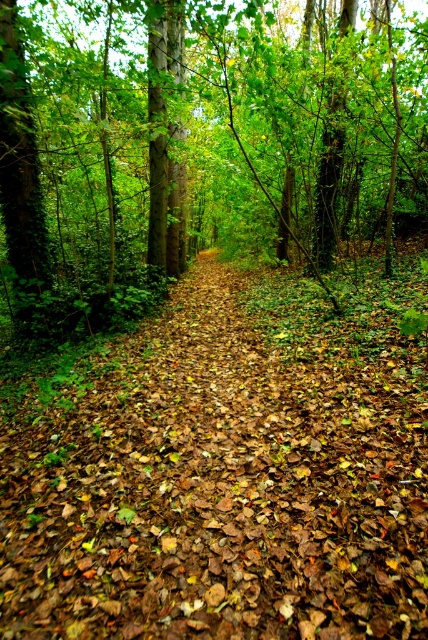
You are a hiker who needs to cross the forest. You see a brown leafy forest path at center and a brown leaf litter at center. Can you walk through the path between them?

The distance between the brown leafy forest path at center and the brown leaf litter at center is 7.92 meters, so yes, you can walk through the path between them as it is wide enough for a hiker to pass through.

You are a hiker trying to decide which area to step on. You see the brown leafy forest path at center and the brown leaf litter at center. Which one is shorter in height?

The brown leafy forest path at center is not as tall as the brown leaf litter at center, so the brown leafy forest path at center is shorter in height.